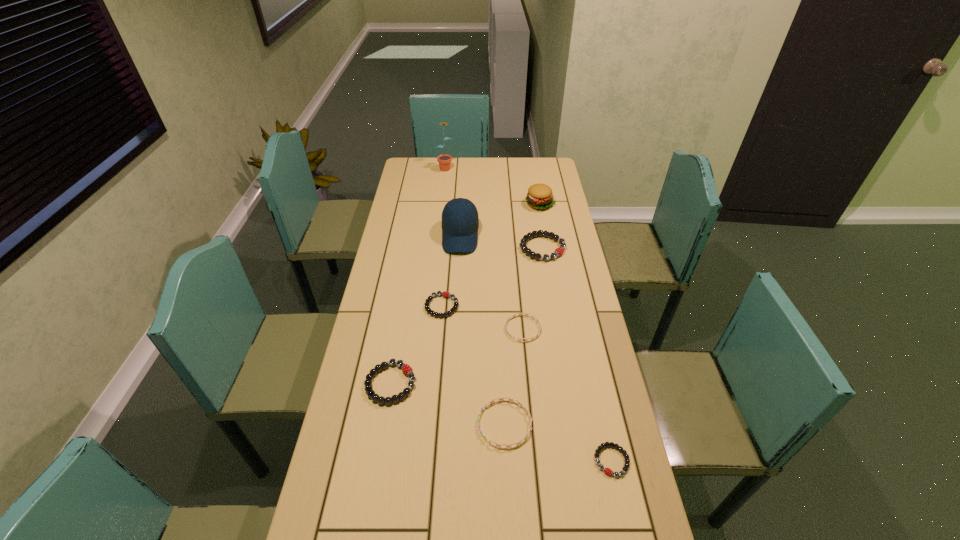
This screenshot has width=960, height=540. Identify the location of free area in between the baseball cap and the smaller blue bracelet. coord(492,282).

The width and height of the screenshot is (960, 540). What are the coordinates of `free spot between the sunflower and the fifth shortest bracelet` in the screenshot? It's located at (418, 275).

At what (x,y) coordinates should I click in order to perform the action: click on free area in between the baseball cap and the bigger blue bracelet. Please return your answer as a coordinate pair (x, y). Image resolution: width=960 pixels, height=540 pixels. Looking at the image, I should click on (483, 330).

Select which object is the seventh closest to the nearest black bracelet. Please provide its 2D coordinates. Your answer should be formatted as a tuple, i.e. [(x, y)], where the tuple contains the x and y coordinates of a point satisfying the conditions above.

[(540, 196)]

You are a GUI agent. You are given a task and a screenshot of the screen. Output one action in this format:
    pyautogui.click(x=<x>, y=<y>)
    Task: Click on the object that is the closest one to the second nearest black bracelet
    The width and height of the screenshot is (960, 540).
    Given the screenshot: What is the action you would take?
    pyautogui.click(x=427, y=302)

Identify which bracelet is the third closest to the smallest black bracelet. Please provide its 2D coordinates. Your answer should be formatted as a tuple, i.e. [(x, y)], where the tuple contains the x and y coordinates of a point satisfying the conditions above.

[(406, 369)]

Identify which bracelet is the fourth closest to the bigger blue bracelet. Please provide its 2D coordinates. Your answer should be formatted as a tuple, i.e. [(x, y)], where the tuple contains the x and y coordinates of a point satisfying the conditions above.

[(427, 302)]

Point out which black bracelet is positioned as the second nearest to the sunflower. Please provide its 2D coordinates. Your answer should be formatted as a tuple, i.e. [(x, y)], where the tuple contains the x and y coordinates of a point satisfying the conditions above.

[(427, 302)]

Identify which black bracelet is the third closest to the nearer blue bracelet. Please provide its 2D coordinates. Your answer should be formatted as a tuple, i.e. [(x, y)], where the tuple contains the x and y coordinates of a point satisfying the conditions above.

[(427, 302)]

Locate an element on the screen. This screenshot has height=540, width=960. the second closest blue bracelet to the fifth tallest object is located at coordinates (526, 314).